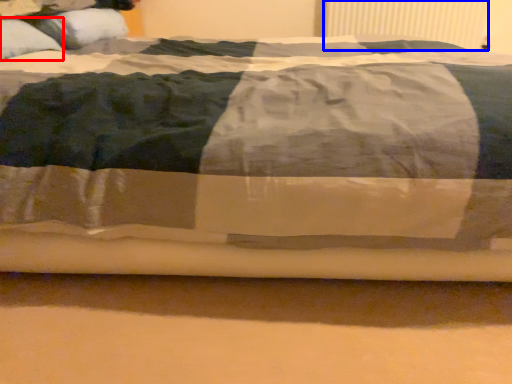
Question: Which object is further to the camera taking this photo, pillow (highlighted by a red box) or radiator (highlighted by a blue box)?

Choices:
 (A) pillow
 (B) radiator

Answer: (B)